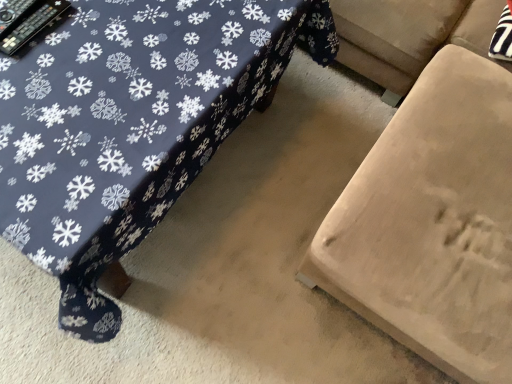
Question: Do you think dark blue fabric table at center is within beige fabric ottoman at lower right, or outside of it?

Choices:
 (A) inside
 (B) outside

Answer: (B)

Question: Is point (202, 74) positioned closer to the camera than point (448, 137)?

Choices:
 (A) closer
 (B) farther

Answer: (A)

Question: Based on their positions, is dark blue fabric table at center located to the left or right of beige fabric ottoman at lower right?

Choices:
 (A) right
 (B) left

Answer: (B)

Question: From the image's perspective, is beige fabric ottoman at lower right above or below dark blue fabric table at center?

Choices:
 (A) above
 (B) below

Answer: (B)

Question: Is beige fabric ottoman at lower right situated inside dark blue fabric table at center or outside?

Choices:
 (A) inside
 (B) outside

Answer: (B)

Question: Considering the positions of point (394, 162) and point (219, 39), is point (394, 162) closer or farther from the camera than point (219, 39)?

Choices:
 (A) closer
 (B) farther

Answer: (B)

Question: Considering the relative positions of beige fabric ottoman at lower right and dark blue fabric table at center in the image provided, is beige fabric ottoman at lower right to the left or to the right of dark blue fabric table at center?

Choices:
 (A) right
 (B) left

Answer: (A)